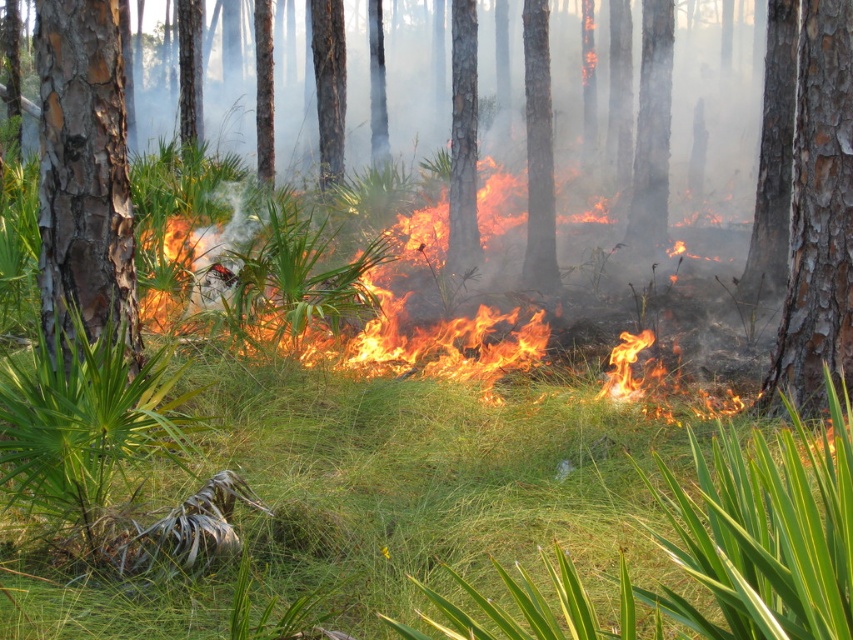
Which is behind, point (375, 314) or point (451, 20)?

The point (451, 20) is behind.

Is point (468, 362) closer to camera compared to point (469, 156)?

Yes, it is.

The height and width of the screenshot is (640, 853). What are the coordinates of `flaming grass at center` in the screenshot? It's located at (412, 340).

Who is positioned more to the left, charcoal textured tree trunk at center or smooth bark tree at center?

smooth bark tree at center is more to the left.

Who is positioned more to the right, charcoal textured tree trunk at center or smooth bark tree at center?

charcoal textured tree trunk at center is more to the right.

Does point (531, 13) come in front of point (451, 144)?

That is False.

At what (x,y) coordinates should I click in order to perform the action: click on charcoal textured tree trunk at center. Please return your answer as a coordinate pair (x, y). The height and width of the screenshot is (640, 853). Looking at the image, I should click on (538, 152).

Which is behind, point (76, 296) or point (549, 211)?

The point (549, 211) is behind.

You are a GUI agent. You are given a task and a screenshot of the screen. Output one action in this format:
    pyautogui.click(x=<x>, y=<y>)
    Task: Click on the smooth brown bark at left
    This screenshot has width=853, height=640.
    Given the screenshot: What is the action you would take?
    pyautogui.click(x=84, y=179)

Locate an element on the screen. This screenshot has width=853, height=640. smooth brown bark at left is located at coordinates 84,179.

The height and width of the screenshot is (640, 853). I want to click on smooth brown bark at left, so click(84, 179).